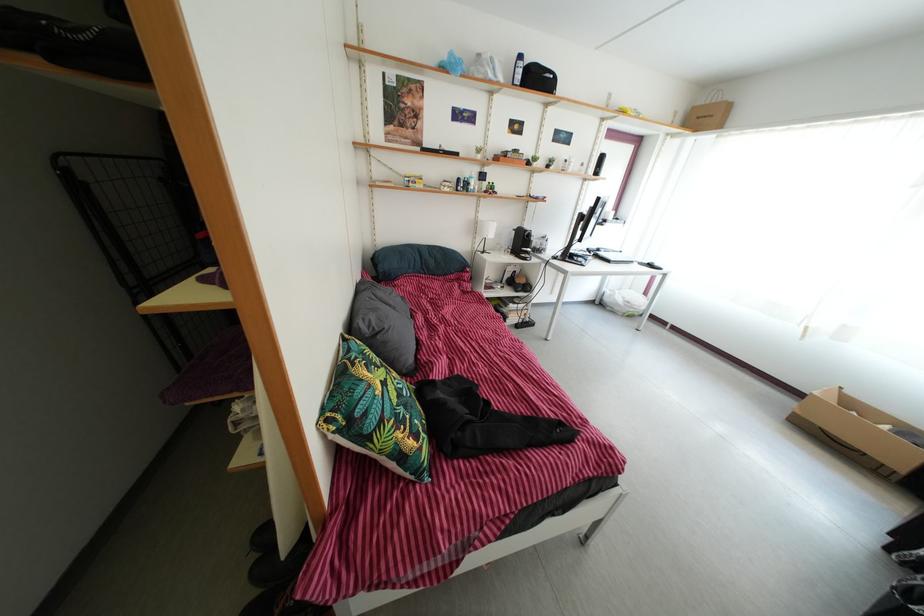
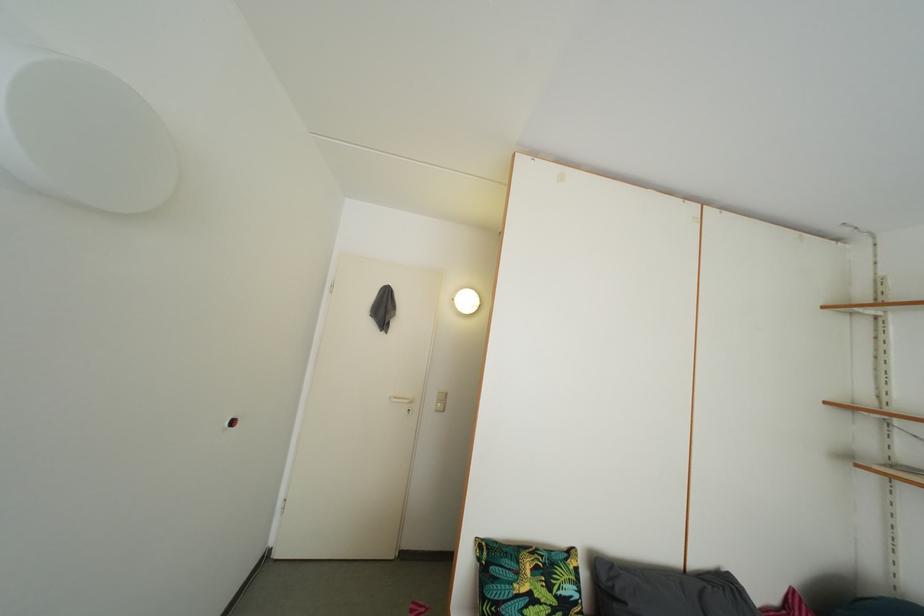
Where in the second image is the point corresponding to (x=383, y=338) from the first image?

(624, 601)